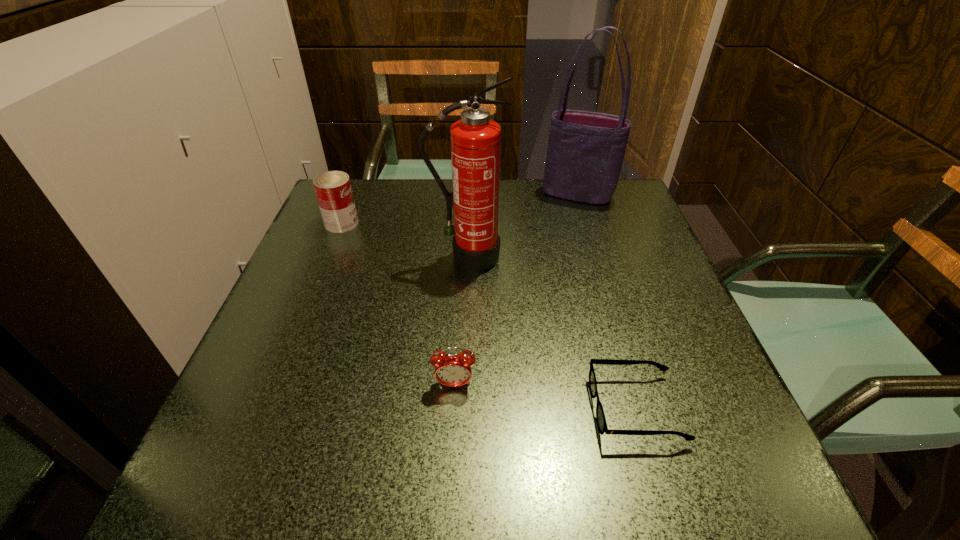
Locate an element on the screen. This screenshot has height=540, width=960. tote bag is located at coordinates (585, 153).

Where is `the third farthest object`? the third farthest object is located at coordinates (475, 140).

Find the location of a particular element. The width and height of the screenshot is (960, 540). the leftmost object is located at coordinates (333, 190).

This screenshot has width=960, height=540. What are the coordinates of `the second farthest object` in the screenshot? It's located at (333, 190).

Where is `alarm clock`? The image size is (960, 540). alarm clock is located at coordinates (452, 369).

I want to click on spectacles, so click(x=600, y=416).

The height and width of the screenshot is (540, 960). Find the location of `vacant space located 0.060m on the left of the farthest object`. vacant space located 0.060m on the left of the farthest object is located at coordinates (520, 194).

This screenshot has height=540, width=960. I want to click on free space located 0.080m on the front-facing side of the fire extinguisher, so click(x=467, y=298).

The width and height of the screenshot is (960, 540). Find the location of `vacant space located on the front label of the third tallest object`. vacant space located on the front label of the third tallest object is located at coordinates (430, 223).

This screenshot has height=540, width=960. I want to click on free region located on the face of the alarm clock, so click(x=450, y=461).